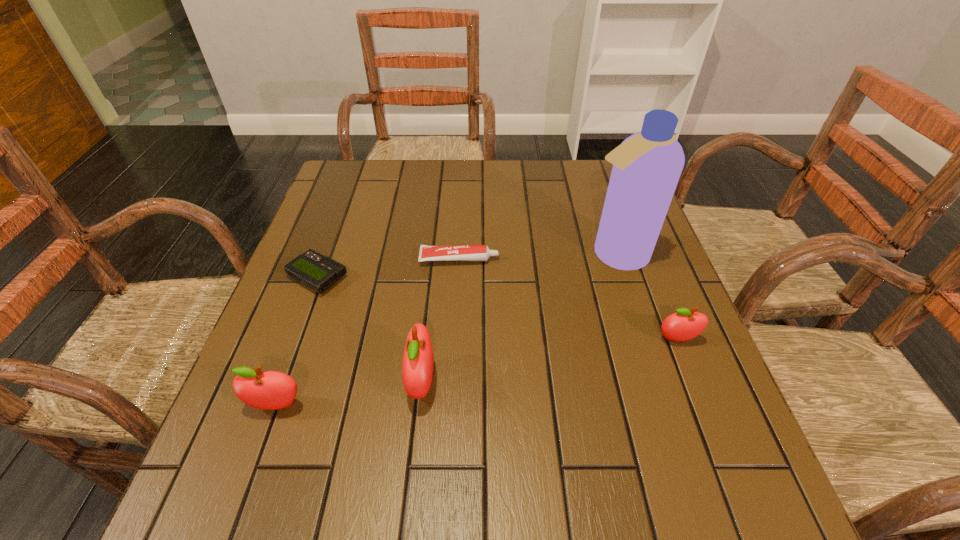
Identify which apple is located as the nearest to the third nearest object. Please provide its 2D coordinates. Your answer should be formatted as a tuple, i.e. [(x, y)], where the tuple contains the x and y coordinates of a point satisfying the conditions above.

[(417, 367)]

You are a GUI agent. You are given a task and a screenshot of the screen. Output one action in this format:
    pyautogui.click(x=<x>, y=<y>)
    Task: Click on the vacant area that satisfies the following two spatial constraints: 1. on the front side of the beeper; 2. on the right side of the third shortest object
    
    Given the screenshot: What is the action you would take?
    pyautogui.click(x=295, y=339)

Where is `blank space that satisfies the following two spatial constraints: 1. on the front side of the tallest object; 2. at the nozzle of the toothpaste`? The height and width of the screenshot is (540, 960). blank space that satisfies the following two spatial constraints: 1. on the front side of the tallest object; 2. at the nozzle of the toothpaste is located at coordinates (616, 259).

Locate an element on the screen. This screenshot has height=540, width=960. free point that satisfies the following two spatial constraints: 1. on the back side of the tallest object; 2. on the right side of the tallest apple is located at coordinates (435, 255).